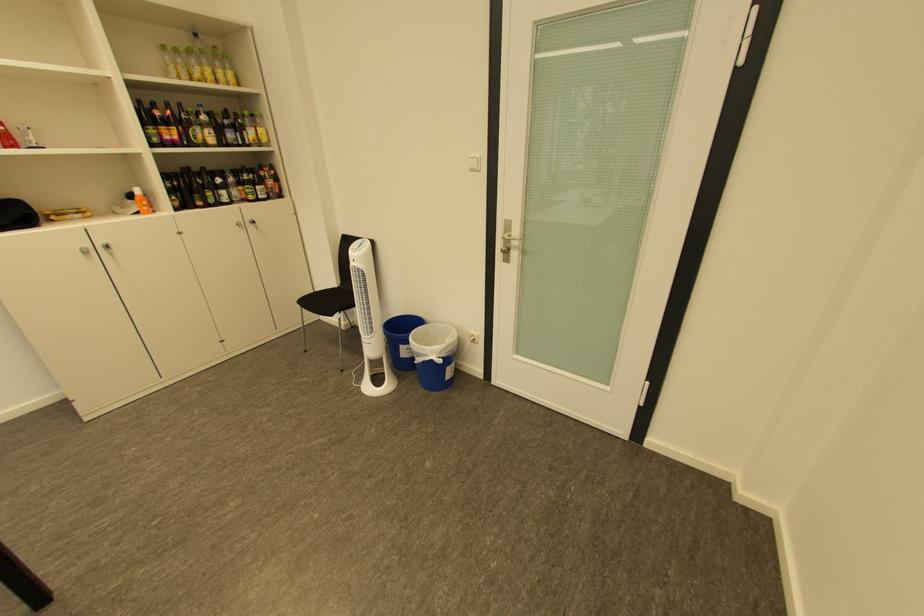
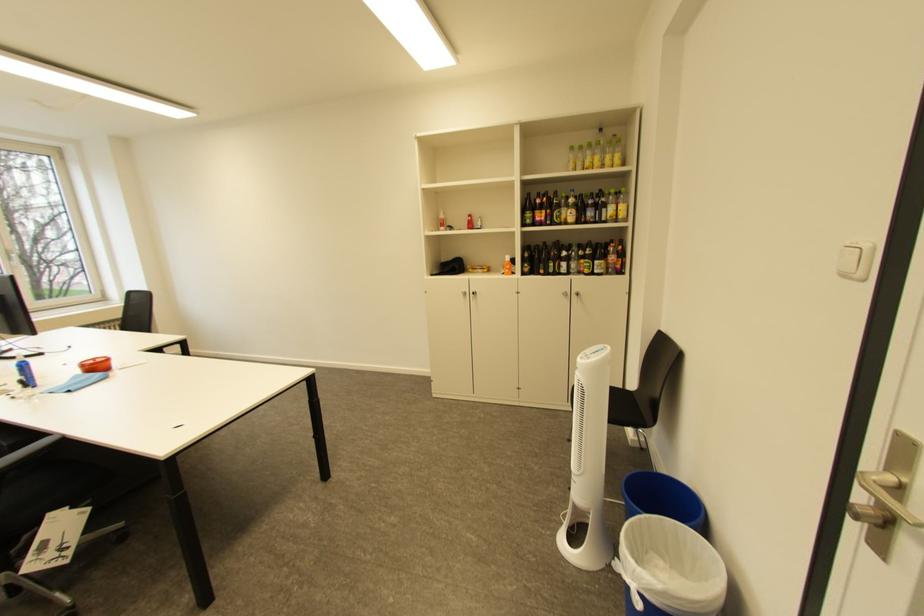
Find the pixel in the second image that matches [92,254] in the first image.

(472, 296)